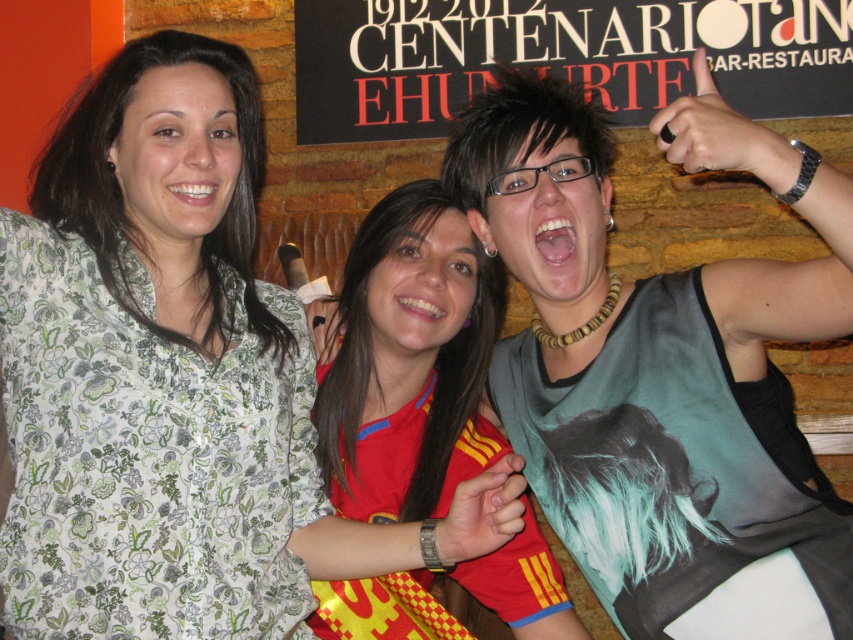
Question: Where is floral-patterned shirt at center located in relation to red/yellow jersey at center in the image?

Choices:
 (A) left
 (B) right

Answer: (A)

Question: Does green printed tank top at right appear under red/yellow jersey at center?

Choices:
 (A) no
 (B) yes

Answer: (A)

Question: Which object is farther from the camera taking this photo?

Choices:
 (A) black cardboard sign at upper center
 (B) green printed tank top at right
 (C) red/yellow jersey at center

Answer: (A)

Question: Can you confirm if black cardboard sign at upper center is positioned above red/yellow jersey at center?

Choices:
 (A) yes
 (B) no

Answer: (A)

Question: Which object is farther from the camera taking this photo?

Choices:
 (A) floral-patterned shirt at center
 (B) green printed tank top at right

Answer: (A)

Question: Which of these objects is positioned closest to the black cardboard sign at upper center?

Choices:
 (A) floral-patterned shirt at center
 (B) red/yellow jersey at center

Answer: (B)